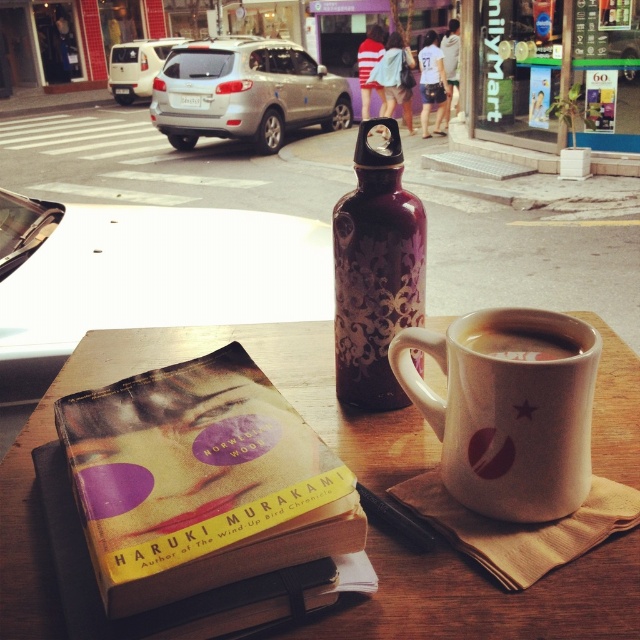
You are sitting in the driver seat of the vehicle and want to grab the purple metallic water bottle at center. Can you reach it without leaving your seat?

The purple metallic water bottle at center is 48.80 centimeters away from you, so you can reach it without leaving your seat as it is within a comfortable arm reach.

You are a passenger in a car parked near a window. On the table inside the car, you see a hardcover book at center and a purple metallic water bottle at center. Which object is closer to the left side of the table?

The hardcover book at center is to the left of the purple metallic water bottle at center, so it is closer to the left side of the table.